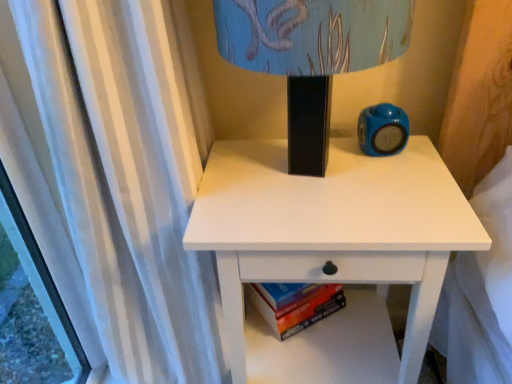
Question: From the image's perspective, is hardcover book at lower center on top of matte plastic alarm clock at upper right?

Choices:
 (A) no
 (B) yes

Answer: (A)

Question: Can you confirm if hardcover book at lower center is bigger than matte plastic alarm clock at upper right?

Choices:
 (A) yes
 (B) no

Answer: (A)

Question: Does hardcover book at lower center appear on the left side of matte plastic alarm clock at upper right?

Choices:
 (A) no
 (B) yes

Answer: (B)

Question: Could matte plastic alarm clock at upper right be considered to be inside hardcover book at lower center?

Choices:
 (A) no
 (B) yes

Answer: (A)

Question: Is hardcover book at lower center located outside matte plastic alarm clock at upper right?

Choices:
 (A) yes
 (B) no

Answer: (A)

Question: From a real-world perspective, does hardcover book at lower center stand above matte plastic alarm clock at upper right?

Choices:
 (A) no
 (B) yes

Answer: (A)

Question: Can you confirm if matte black lampshade at upper center is wider than matte plastic alarm clock at upper right?

Choices:
 (A) yes
 (B) no

Answer: (A)

Question: Is matte plastic alarm clock at upper right at the back of matte black lampshade at upper center?

Choices:
 (A) no
 (B) yes

Answer: (A)

Question: Is matte black lampshade at upper center beside matte plastic alarm clock at upper right?

Choices:
 (A) yes
 (B) no

Answer: (B)

Question: Can you confirm if matte black lampshade at upper center is positioned to the left of matte plastic alarm clock at upper right?

Choices:
 (A) no
 (B) yes

Answer: (B)

Question: Can you confirm if matte black lampshade at upper center is taller than matte plastic alarm clock at upper right?

Choices:
 (A) no
 (B) yes

Answer: (B)

Question: Does matte black lampshade at upper center come in front of matte plastic alarm clock at upper right?

Choices:
 (A) no
 (B) yes

Answer: (B)

Question: Is matte plastic alarm clock at upper right not inside matte black lampshade at upper center?

Choices:
 (A) no
 (B) yes

Answer: (A)